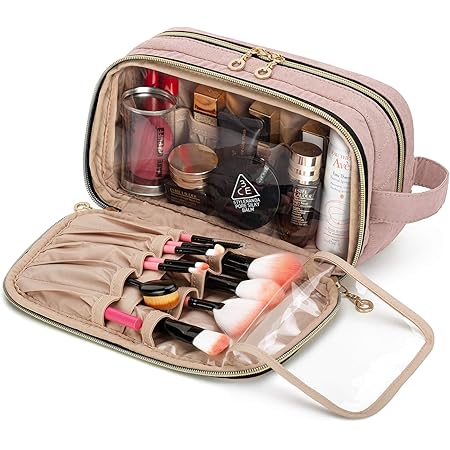
Locate an element on the screen. The image size is (450, 450). brush storage is located at coordinates (93, 307), (108, 272), (132, 248), (146, 237), (175, 232), (153, 323), (184, 297), (203, 279), (221, 259).